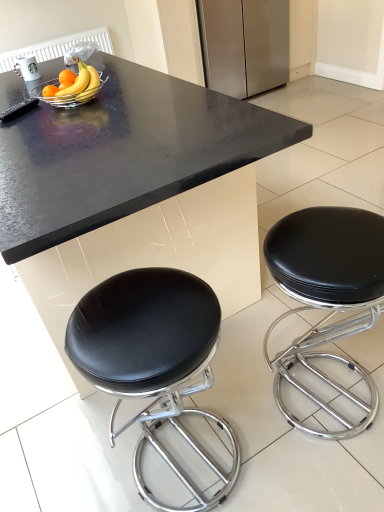
Locate an element on the screen. free point above black leather stool at lower right, the 1th stool viewed from the left (from a real-world perspective) is located at coordinates (142, 326).